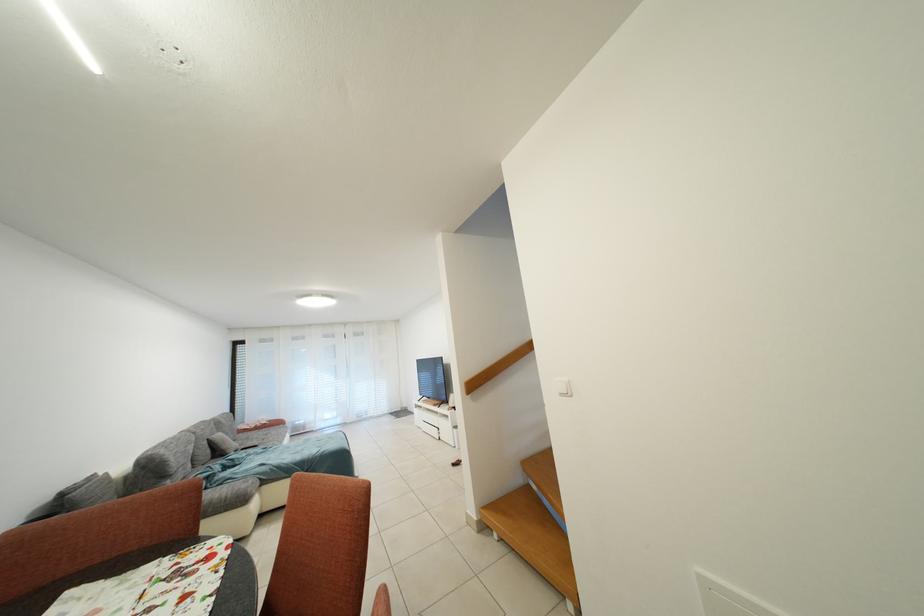
The image size is (924, 616). Identify the location of sofa sitting surface. (296, 458).